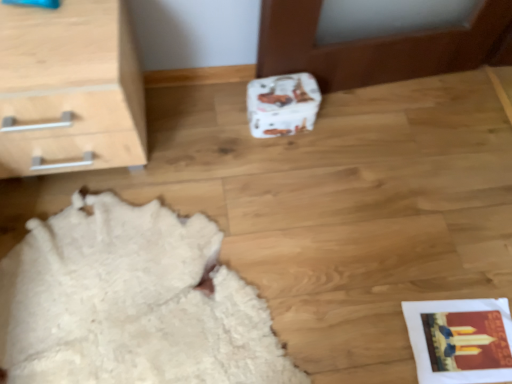
Identify the location of spots to the right of white paper shoe box at center. (338, 127).